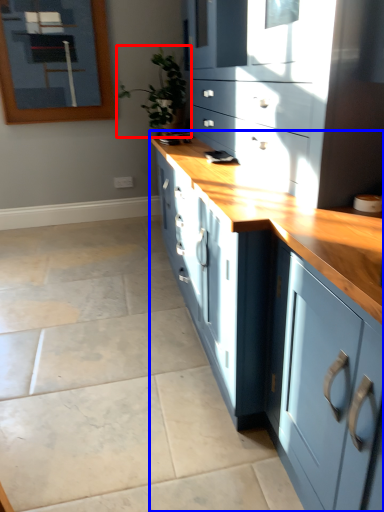
Question: Which object appears closest to the camera in this image, houseplant (highlighted by a red box) or cabinetry (highlighted by a blue box)?

Choices:
 (A) houseplant
 (B) cabinetry

Answer: (B)